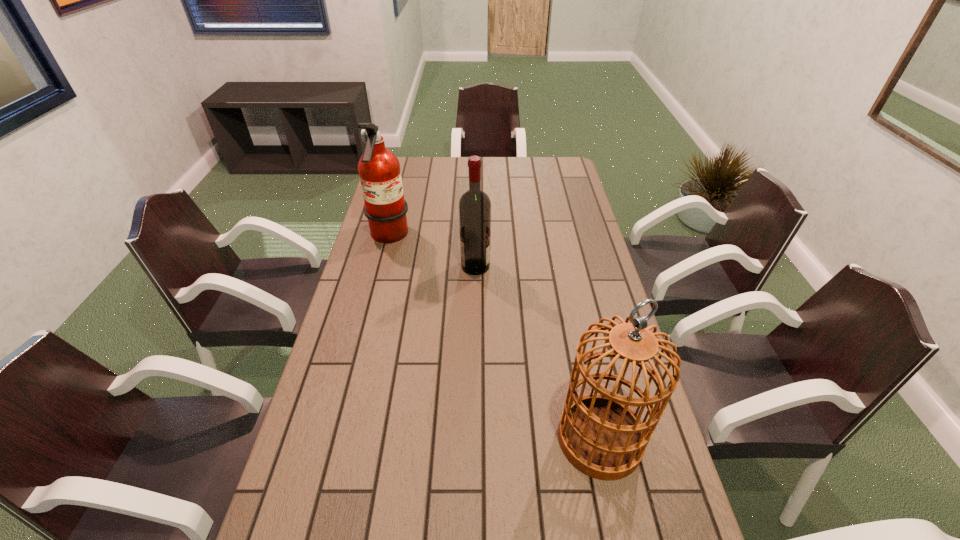
The height and width of the screenshot is (540, 960). In the image, there is a desktop. Find the location of `free space at the left edge`. free space at the left edge is located at coordinates (368, 332).

The image size is (960, 540). I want to click on vacant area at the far left corner of the desktop, so click(412, 173).

Find the location of a particular element. vacant space at the far right corner of the desktop is located at coordinates [x=549, y=177].

The image size is (960, 540). I want to click on unoccupied position between the alcohol and the rightmost object, so click(538, 353).

Identify the location of free area in between the leftmost object and the alcohol. [432, 252].

Where is `free space between the birdcage and the second object from right to left`? free space between the birdcage and the second object from right to left is located at coordinates (538, 353).

Locate an element on the screen. This screenshot has height=540, width=960. object that stands as the second closest to the nearest object is located at coordinates (379, 170).

Locate which object ranks in proximity to the fire extinguisher. Please provide its 2D coordinates. Your answer should be formatted as a tuple, i.e. [(x, y)], where the tuple contains the x and y coordinates of a point satisfying the conditions above.

[(474, 205)]

The width and height of the screenshot is (960, 540). I want to click on blank space that satisfies the following two spatial constraints: 1. on the front and back of the second object from right to left; 2. on the back side of the rightmost object, so click(473, 439).

Where is `free location that satisfies the following two spatial constraints: 1. on the back side of the nearest object; 2. on the front and back of the alcohol`? free location that satisfies the following two spatial constraints: 1. on the back side of the nearest object; 2. on the front and back of the alcohol is located at coordinates (563, 266).